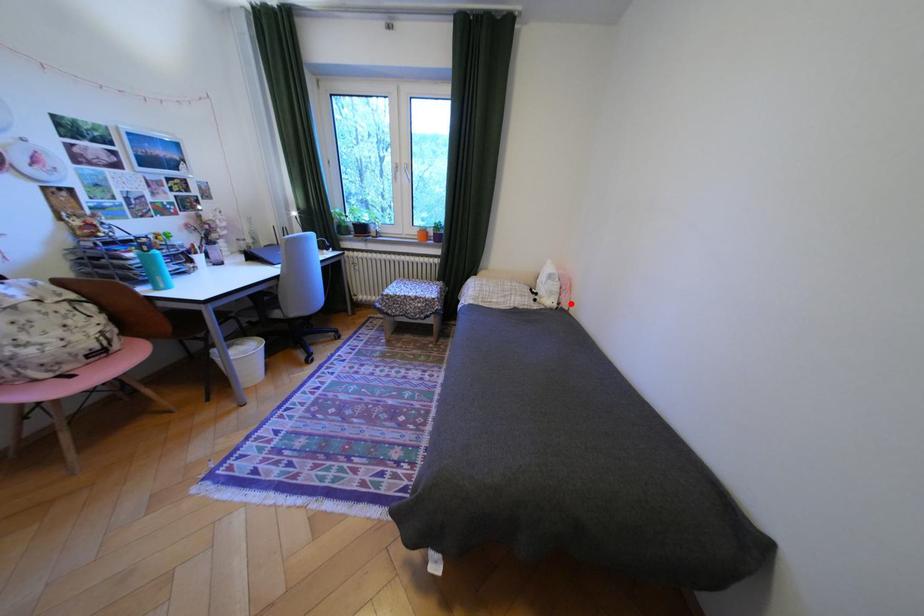
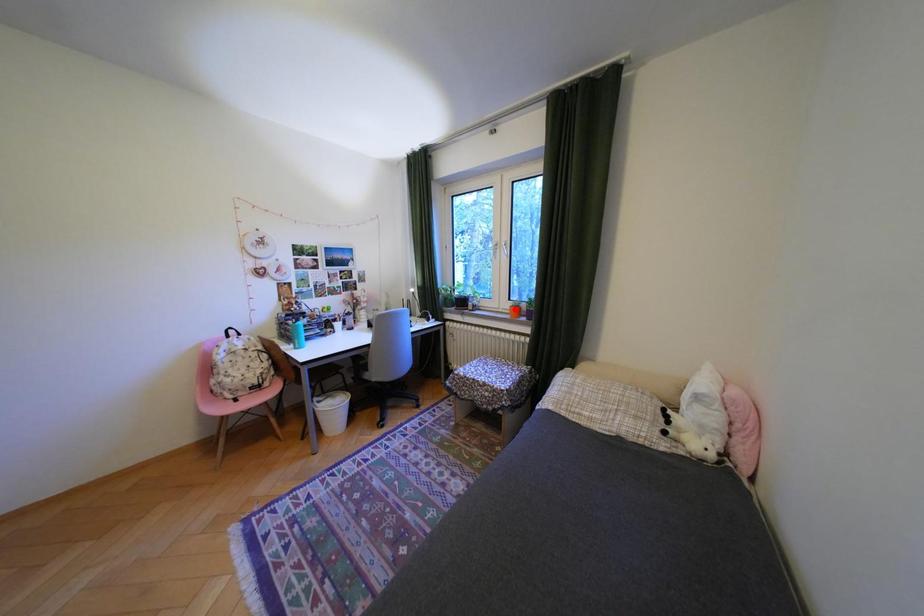
I am providing you with two images of the same scene from different viewpoints. A red point is marked on the first image and another point is marked on the second image. Does the point marked in image1 correspond to the same location as the one in image2?

No